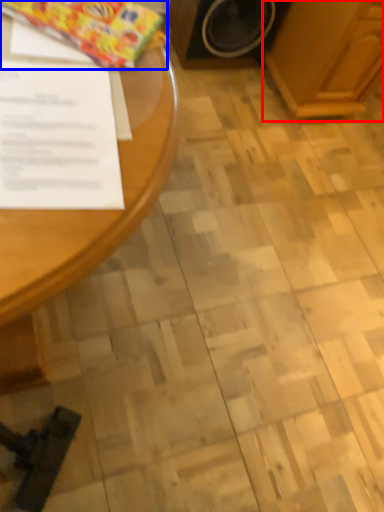
Question: Which object is closer to the camera taking this photo, wood (highlighted by a red box) or wrapping paper (highlighted by a blue box)?

Choices:
 (A) wood
 (B) wrapping paper

Answer: (B)